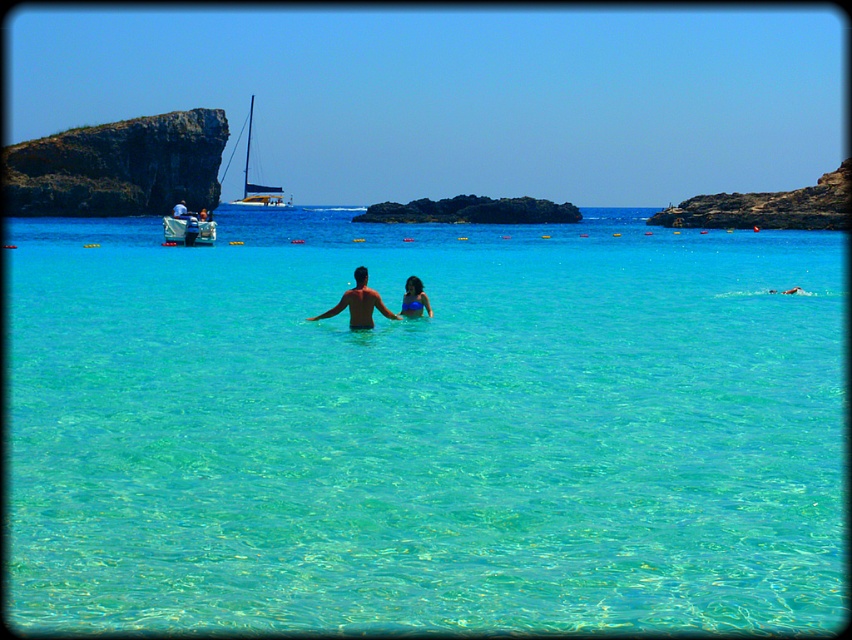
Looking at this image, you are a photographer planning to capture the entire scene in one shot. Given that the clear water at center and the rocky cliff at upper right are both important elements, which object should you prioritize framing first to ensure it occupies more space in the photo?

The clear water at center has a larger size compared to the rocky cliff at upper right, so you should prioritize framing the clear water at center first to ensure it occupies more space in the photo.

You are a photographer planning to capture a wide shot of the beach scene. You want to ensure both the rocky cliff at upper right and the white sailboat at upper left are visible in your frame. Based on their sizes, which object should you prioritize positioning closer to the camera to maintain their visual prominence?

The rocky cliff at upper right has a lesser width compared to the white sailboat at upper left. To maintain visual prominence, prioritize positioning the rocky cliff at upper right closer to the camera since smaller objects need to be nearer to appear prominent in the frame.